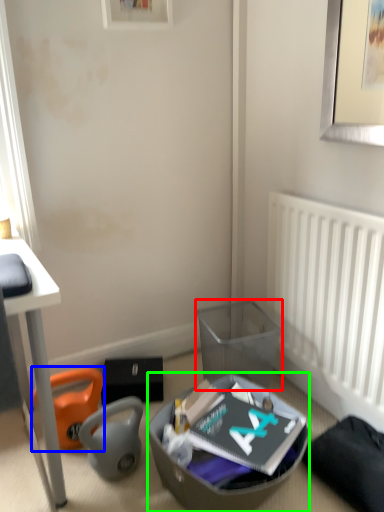
Question: Which is nearer to the trash bin/can (highlighted by a red box)? bean bag chair (highlighted by a blue box) or shoe box (highlighted by a green box).

Choices:
 (A) bean bag chair
 (B) shoe box

Answer: (B)